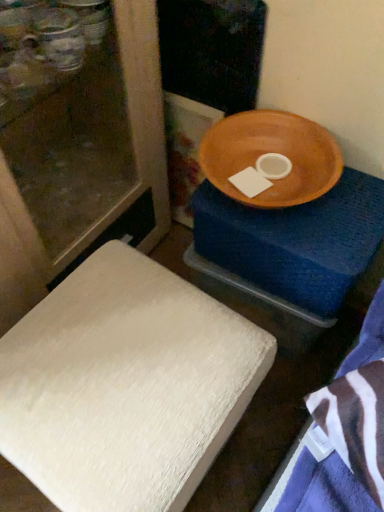
The image size is (384, 512). I want to click on free space above white textured cushion at lower left (from a real-world perspective), so click(x=112, y=367).